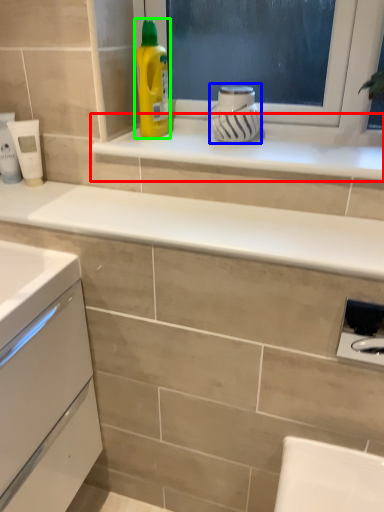
Question: Which object is positioned closest to window sill (highlighted by a red box)? Select from appliance (highlighted by a blue box) and cleaning product (highlighted by a green box).

Choices:
 (A) appliance
 (B) cleaning product

Answer: (A)